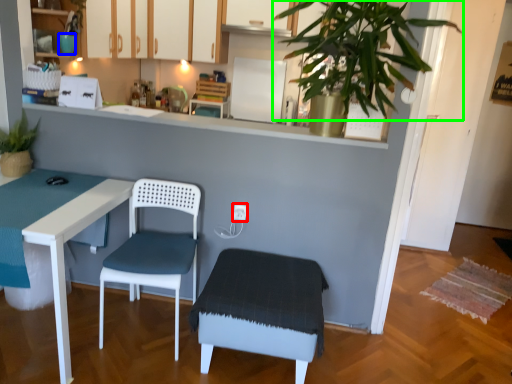
Question: Which is farther away from electric outlet (highlighted by a red box)? teal (highlighted by a blue box) or vegetation (highlighted by a green box)?

Choices:
 (A) teal
 (B) vegetation

Answer: (A)